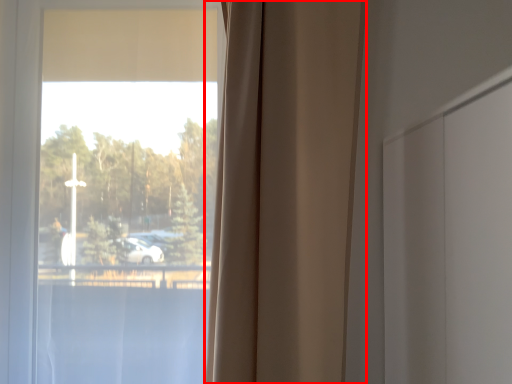
Question: From the image's perspective, considering the relative positions of curtain (annotated by the red box) and window in the image provided, where is curtain (annotated by the red box) located with respect to the staircase?

Choices:
 (A) above
 (B) below

Answer: (A)